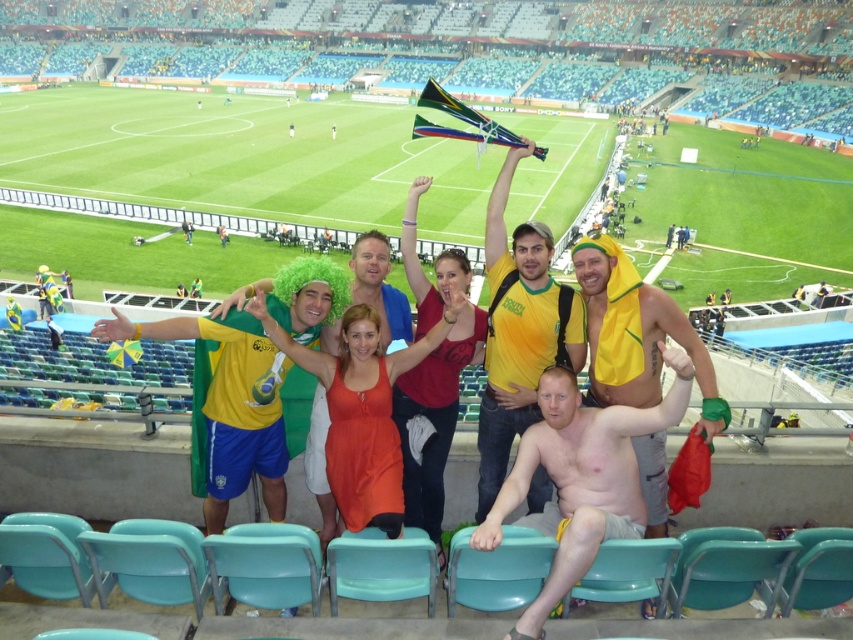
Question: Estimate the real-world distances between objects in this image. Which object is farther from the yellow fabric shirt at center?

Choices:
 (A) yellow fabric towel at right
 (B) shiny metallic helmet at lower right

Answer: (B)

Question: Can you confirm if yellow fabric shirt at center is positioned to the right of yellow fabric towel at right?

Choices:
 (A) yes
 (B) no

Answer: (B)

Question: Among these points, which one is nearest to the camera?

Choices:
 (A) (515, 161)
 (B) (677, 380)
 (C) (648, 524)

Answer: (B)

Question: Which point is closer to the camera?

Choices:
 (A) shiny metallic helmet at lower right
 (B) yellow fabric towel at right
 (C) yellow fabric shirt at center

Answer: (A)

Question: Where is shiny metallic helmet at lower right located in relation to yellow fabric shirt at center in the image?

Choices:
 (A) left
 (B) right

Answer: (B)

Question: Does yellow fabric shirt at center have a smaller size compared to yellow fabric towel at right?

Choices:
 (A) no
 (B) yes

Answer: (A)